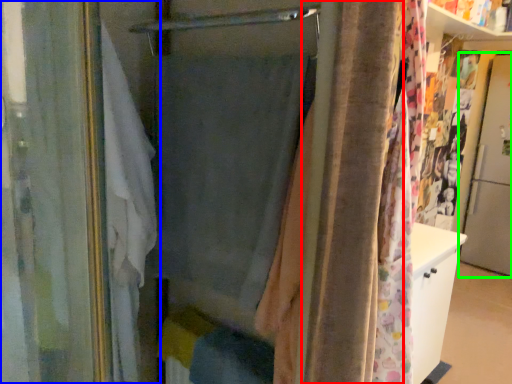
Question: Which object is positioned closest to shower curtain (highlighted by a red box)? Select from curtain (highlighted by a blue box) and screen door (highlighted by a green box).

Choices:
 (A) curtain
 (B) screen door

Answer: (A)